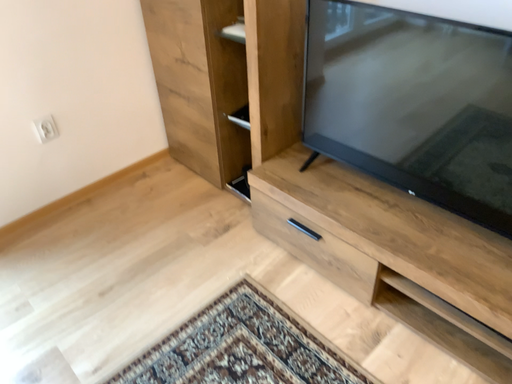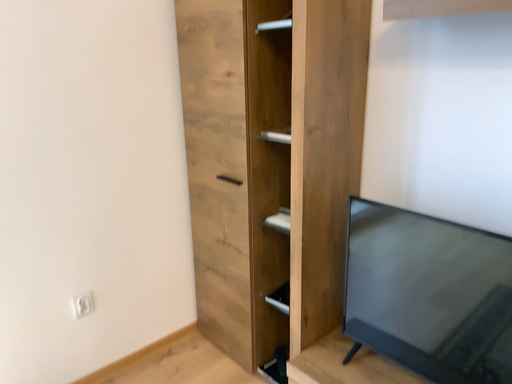
Question: Which way did the camera rotate in the video?

Choices:
 (A) rotated downward
 (B) rotated upward

Answer: (B)